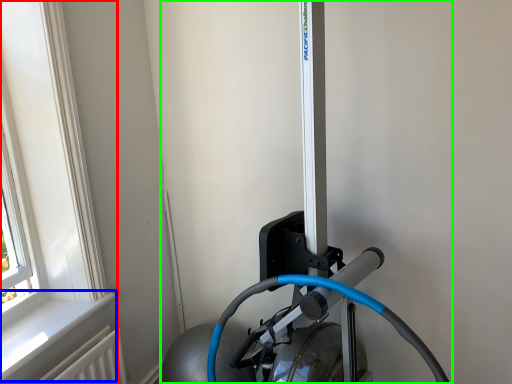
Question: Based on their relative distances, which object is farther from window (highlighted by a red box)? Choose from window sill (highlighted by a blue box) and sport equipment (highlighted by a green box).

Choices:
 (A) window sill
 (B) sport equipment

Answer: (B)